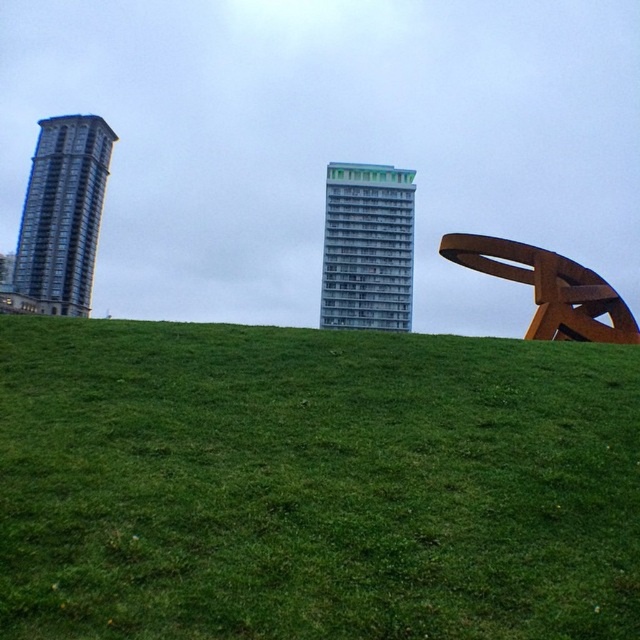
You are standing at the base of the grassy hill in the urban landscape and want to walk towards the sculpture on the right. There are two points marked on your path. Which point, point 1 at coordinates [532,432] or point 2 at coordinates [596,310], will you reach first?

You will reach point 1 at coordinates [532,432] first because it is in front of point 2 at coordinates [596,310] along your path.

Consider the image. You are a gardener planning to mow the green grassy at center and the rusty metal sculpture at right. Which area requires a wider mower path?

The rusty metal sculpture at right requires a wider mower path since it has a greater width than the green grassy at center according to the description.